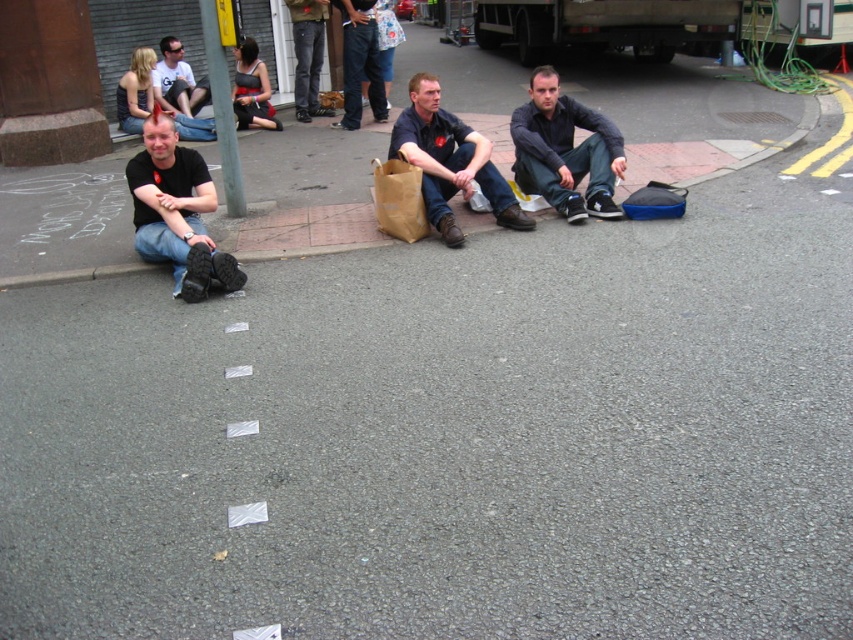
You are a fashion designer observing the scene. You notice the black matte shirt at left and the dark blue jeans at center. Which clothing item is positioned lower in the image?

The black matte shirt at left is below dark blue jeans at center, so the black matte shirt at left is positioned lower in the image.

You are a photographer trying to capture a candid shot of the black matte shirt at left and the dark blue shirt at center. Since you want to ensure both subjects are in focus, you need to know which one is closer to the camera. Can you determine which subject is nearer based on their spatial relationship?

The black matte shirt at left occupies less space than dark blue shirt at center, which suggests it is farther away from the camera. Therefore, the dark blue shirt at center is closer to the camera.

You are standing on the curb where the three men are sitting. If you look towards the asphalt road in front of you, which point would appear closer to you, point (x=236, y=284) or point (x=549, y=108)?

Point (x=236, y=284) is closer to the viewer than point (x=549, y=108).